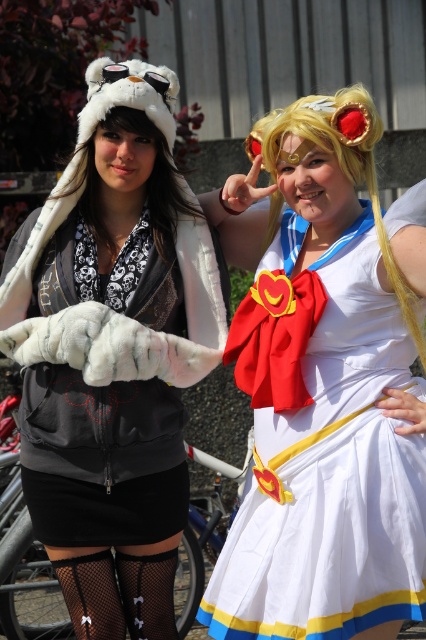
You are a photographer trying to capture a closeup of the white fur hat at upper left. Based on the coordinates provided, where exactly should you aim your camera?

The white fur hat at upper left is located at coordinates point (x=112, y=353).

You are a photographer at a cosplay event. You want to take a photo of the white satin dress at center and the blonde hair at center. Based on their positions, which one will be more visible in the photo?

The white satin dress at center is in front of blonde hair at center, so the white satin dress at center will be more visible in the photo.

You are a photographer standing at point [140,234]. You want to take a photo of the two cosplayers. The camera you are using has a maximum focus range of 15 feet. Will the camera be able to focus on the cosplayers?

The distance between point [140,234] and the camera is 14.17 feet, which is within the camera maximum focus range of 15 feet. Therefore, the camera can focus on the cosplayers.